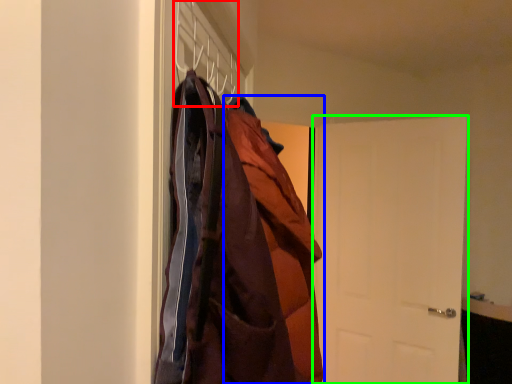
Question: Estimate the real-world distances between objects in this image. Which object is farther from hanger (highlighted by a red box), cloak (highlighted by a blue box) or door (highlighted by a green box)?

Choices:
 (A) cloak
 (B) door

Answer: (B)